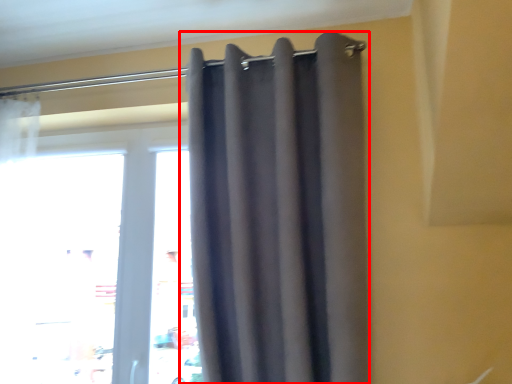
Question: From the image's perspective, where is curtain (annotated by the red box) located in relation to window in the image?

Choices:
 (A) above
 (B) below

Answer: (A)